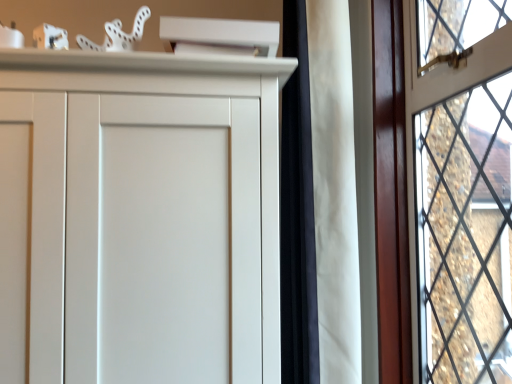
Question: Should I look upward or downward to see white matte curtain at center?

Choices:
 (A) down
 (B) up

Answer: (B)

Question: Does matte wooden window at right have a larger size compared to white matte curtain at center?

Choices:
 (A) yes
 (B) no

Answer: (B)

Question: From the image's perspective, does matte wooden window at right appear higher than white matte curtain at center?

Choices:
 (A) yes
 (B) no

Answer: (B)

Question: From the image's perspective, is matte wooden window at right under white matte curtain at center?

Choices:
 (A) yes
 (B) no

Answer: (A)

Question: Does matte wooden window at right have a lesser width compared to white matte curtain at center?

Choices:
 (A) yes
 (B) no

Answer: (B)

Question: Is matte wooden window at right facing away from white matte curtain at center?

Choices:
 (A) no
 (B) yes

Answer: (B)

Question: Is matte wooden window at right to the right of white matte curtain at center from the viewer's perspective?

Choices:
 (A) no
 (B) yes

Answer: (B)

Question: Considering the relative sizes of white matte curtain at center and matte wooden window at right in the image provided, is white matte curtain at center smaller than matte wooden window at right?

Choices:
 (A) no
 (B) yes

Answer: (A)

Question: Does white matte curtain at center lie behind matte wooden window at right?

Choices:
 (A) no
 (B) yes

Answer: (B)

Question: Does white matte curtain at center have a larger size compared to matte wooden window at right?

Choices:
 (A) no
 (B) yes

Answer: (B)

Question: Is white matte curtain at center facing towards matte wooden window at right?

Choices:
 (A) no
 (B) yes

Answer: (B)

Question: Is white matte curtain at center to the right of matte wooden window at right from the viewer's perspective?

Choices:
 (A) yes
 (B) no

Answer: (B)

Question: Is white matte curtain at center oriented away from matte wooden window at right?

Choices:
 (A) no
 (B) yes

Answer: (B)

Question: Considering the positions of matte wooden window at right and white matte curtain at center in the image, is matte wooden window at right wider or thinner than white matte curtain at center?

Choices:
 (A) wide
 (B) thin

Answer: (A)